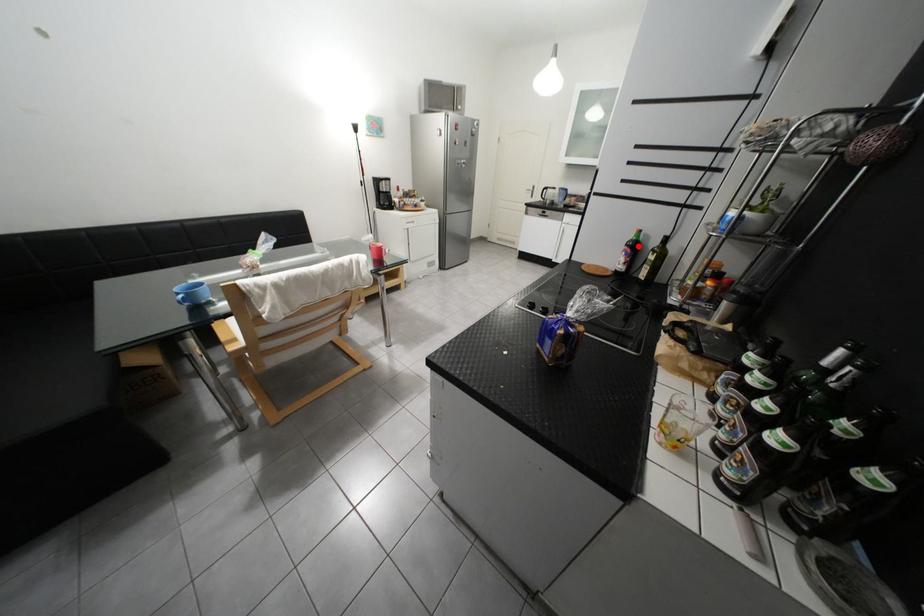
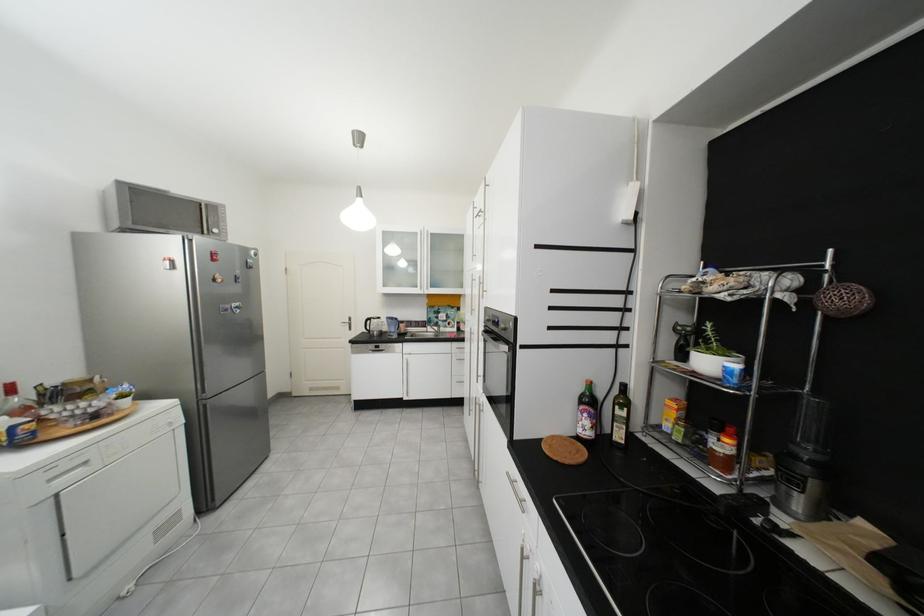
Question: I am providing you with two images of the same scene from different viewpoints. Image1 has a red point marked. In image2, the corresponding 3D location appears at what relative position? Reply with the corresponding letter.

Choices:
 (A) Closer
 (B) Farther

Answer: (B)